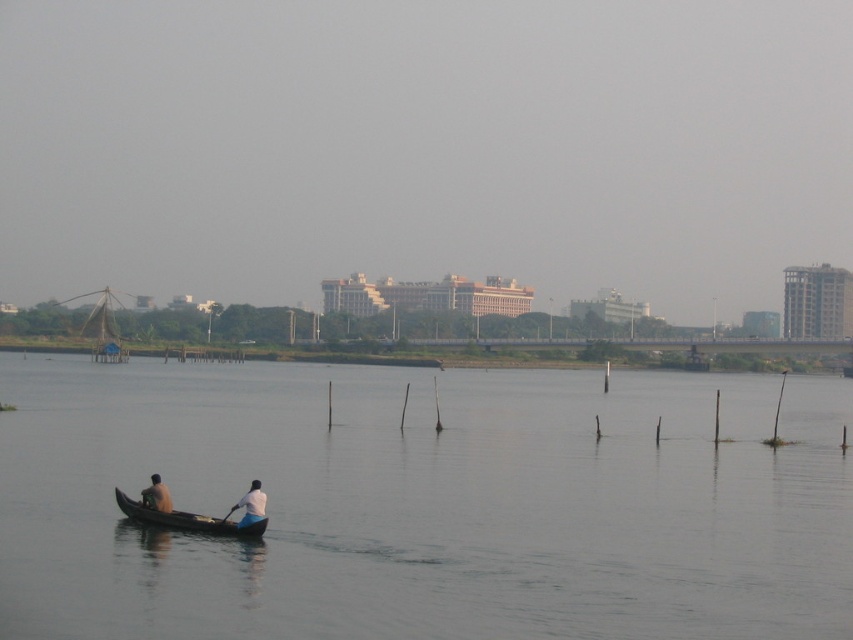
Is the position of dark brown wood canoe at lower left more distant than that of skinny man at left?

No, it is not.

Can you confirm if dark brown wood canoe at lower left is positioned to the left of skinny man at left?

No, dark brown wood canoe at lower left is not to the left of skinny man at left.

Is point (169, 525) farther from camera compared to point (141, 490)?

No, it is in front of (141, 490).

The image size is (853, 640). What are the coordinates of `dark brown wood canoe at lower left` in the screenshot? It's located at (186, 518).

Which is behind, point (161, 486) or point (219, 520)?

The point (161, 486) is behind.

Does skinny man at left come in front of white plastic paddle at lower center?

No, skinny man at left is behind white plastic paddle at lower center.

This screenshot has width=853, height=640. What do you see at coordinates (155, 496) in the screenshot?
I see `skinny man at left` at bounding box center [155, 496].

At what (x,y) coordinates should I click in order to perform the action: click on skinny man at left. Please return your answer as a coordinate pair (x, y). Looking at the image, I should click on (155, 496).

Measure the distance between black smooth water at center and skinny man at left.

black smooth water at center and skinny man at left are 110.78 feet apart from each other.

Does point (238, 378) come behind point (158, 490)?

Yes, it is.

The height and width of the screenshot is (640, 853). Describe the element at coordinates (424, 502) in the screenshot. I see `black smooth water at center` at that location.

Identify the location of black smooth water at center. (424, 502).